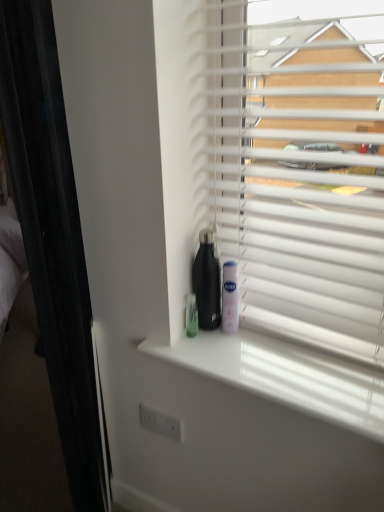
What do you see at coordinates (207, 282) in the screenshot?
I see `black matte water bottle at center` at bounding box center [207, 282].

You are a GUI agent. You are given a task and a screenshot of the screen. Output one action in this format:
    pyautogui.click(x=<x>, y=<y>)
    Task: Click on the white glossy window sill at center
    
    Given the screenshot: What is the action you would take?
    pyautogui.click(x=285, y=374)

Describe the element at coordinates (230, 298) in the screenshot. I see `white plastic mouthwash at center` at that location.

Measure the distance between white plastic blinds at upper right and camera.

33.40 inches.

Find the location of a particular element. This screenshot has width=384, height=512. black matte water bottle at center is located at coordinates (207, 282).

Looking at their sizes, would you say black matte water bottle at center is wider or thinner than white glossy window sill at center?

Considering their sizes, black matte water bottle at center looks slimmer than white glossy window sill at center.

Measure the distance between black matte water bottle at center and white glossy window sill at center.

A distance of 23.18 centimeters exists between black matte water bottle at center and white glossy window sill at center.

How different are the orientations of black matte water bottle at center and white glossy window sill at center in degrees?

The facing directions of black matte water bottle at center and white glossy window sill at center are 4.7 degrees apart.

Is black matte water bottle at center facing towards white glossy window sill at center?

No, black matte water bottle at center is not oriented towards white glossy window sill at center.

From a real-world perspective, who is located lower, white glossy window sill at center or white plastic mouthwash at center?

In real-world perspective, white glossy window sill at center is lower.

Does white glossy window sill at center have a lesser height compared to white plastic mouthwash at center?

Correct, white glossy window sill at center is not as tall as white plastic mouthwash at center.

Is white glossy window sill at center bigger than white plastic mouthwash at center?

Yes.

Who is smaller, black matte water bottle at center or white plastic blinds at upper right?

black matte water bottle at center is smaller.

Does black matte water bottle at center turn towards white plastic blinds at upper right?

Yes, black matte water bottle at center is aimed at white plastic blinds at upper right.

Is black matte water bottle at center inside or outside of white plastic blinds at upper right?

black matte water bottle at center is contained in white plastic blinds at upper right.

Is the surface of white glossy window sill at center in direct contact with black matte water bottle at center?

No, white glossy window sill at center is not with black matte water bottle at center.

Does point (168, 358) come farther from viewer compared to point (198, 273)?

No, it is in front of (198, 273).

From the picture: Is black matte water bottle at center completely or partially inside white glossy window sill at center?

No.

How far apart are white glossy window sill at center and black matte water bottle at center?

A distance of 23.18 centimeters exists between white glossy window sill at center and black matte water bottle at center.

Is white plastic mouthwash at center outside of white plastic blinds at upper right?

That's incorrect, white plastic mouthwash at center is not completely outside white plastic blinds at upper right.

From the image's perspective, is white plastic mouthwash at center located above or below white plastic blinds at upper right?

white plastic mouthwash at center is situated lower than white plastic blinds at upper right in the image.

What's the angular difference between white plastic mouthwash at center and white plastic blinds at upper right's facing directions?

There is a 6-degree angle between the facing directions of white plastic mouthwash at center and white plastic blinds at upper right.

Between white plastic mouthwash at center and white plastic blinds at upper right, which one appears on the right side from the viewer's perspective?

Positioned to the right is white plastic blinds at upper right.

From a real-world perspective, relative to white plastic mouthwash at center, is white plastic blinds at upper right vertically above or below?

white plastic blinds at upper right is situated higher than white plastic mouthwash at center in the real world.

Consider the image. In the image, is white plastic blinds at upper right on the left side or the right side of white plastic mouthwash at center?

From the image, it's evident that white plastic blinds at upper right is to the right of white plastic mouthwash at center.

Which of these two, white plastic blinds at upper right or white plastic mouthwash at center, stands shorter?

Standing shorter between the two is white plastic mouthwash at center.

How many degrees apart are the facing directions of white plastic blinds at upper right and white plastic mouthwash at center?

6 degrees.

Considering the positions of objects black matte water bottle at center and white plastic mouthwash at center in the image provided, who is more to the left, black matte water bottle at center or white plastic mouthwash at center?

black matte water bottle at center.

Does point (208, 300) lie in front of point (226, 327)?

Yes, point (208, 300) is closer to viewer.

Is black matte water bottle at center aimed at white plastic mouthwash at center?

No, black matte water bottle at center is not aimed at white plastic mouthwash at center.

Find the location of a particular element. The image size is (384, 512). bottle that appears on the left of white glossy window sill at center is located at coordinates (207, 282).

Locate an element on the screen. The image size is (384, 512). mouthwash behind the white glossy window sill at center is located at coordinates (230, 298).

Estimate the real-world distances between objects in this image. Which object is further from black matte water bottle at center, white plastic blinds at upper right or white glossy window sill at center?

white plastic blinds at upper right is positioned further to the anchor black matte water bottle at center.

Considering their positions, is black matte water bottle at center positioned further to white plastic mouthwash at center than white plastic blinds at upper right?

Among the two, white plastic blinds at upper right is located further to white plastic mouthwash at center.

Based on their spatial positions, is white glossy window sill at center or black matte water bottle at center further from white plastic blinds at upper right?

Among the two, black matte water bottle at center is located further to white plastic blinds at upper right.

Looking at the image, which one is located further to white plastic mouthwash at center, white glossy window sill at center or black matte water bottle at center?

Based on the image, white glossy window sill at center appears to be further to white plastic mouthwash at center.

In the scene shown: Based on their spatial positions, is white glossy window sill at center or white plastic blinds at upper right further from black matte water bottle at center?

Based on the image, white plastic blinds at upper right appears to be further to black matte water bottle at center.

Based on their spatial positions, is white glossy window sill at center or white plastic blinds at upper right closer to white plastic mouthwash at center?

white glossy window sill at center is closer to white plastic mouthwash at center.

Considering their positions, is white glossy window sill at center positioned further to white plastic blinds at upper right than white plastic mouthwash at center?

The object further to white plastic blinds at upper right is white plastic mouthwash at center.

Which object lies nearer to the anchor point white plastic blinds at upper right, black matte water bottle at center or white plastic mouthwash at center?

black matte water bottle at center lies closer to white plastic blinds at upper right than the other object.

You are a GUI agent. You are given a task and a screenshot of the screen. Output one action in this format:
    pyautogui.click(x=<x>, y=<y>)
    Task: Click on the bottle between white plastic blinds at upper right and white glossy window sill at center in the up-down direction
    The width and height of the screenshot is (384, 512).
    Given the screenshot: What is the action you would take?
    pyautogui.click(x=207, y=282)

At what (x,y) coordinates should I click in order to perform the action: click on bottle located between white plastic blinds at upper right and white plastic mouthwash at center in the depth direction. Please return your answer as a coordinate pair (x, y). Looking at the image, I should click on (207, 282).

Locate an element on the screen. This screenshot has height=512, width=384. mouthwash between white plastic blinds at upper right and white glossy window sill at center from top to bottom is located at coordinates pyautogui.click(x=230, y=298).

Where is `bottle positioned between white glossy window sill at center and white plastic mouthwash at center from near to far`? The width and height of the screenshot is (384, 512). bottle positioned between white glossy window sill at center and white plastic mouthwash at center from near to far is located at coordinates (207, 282).